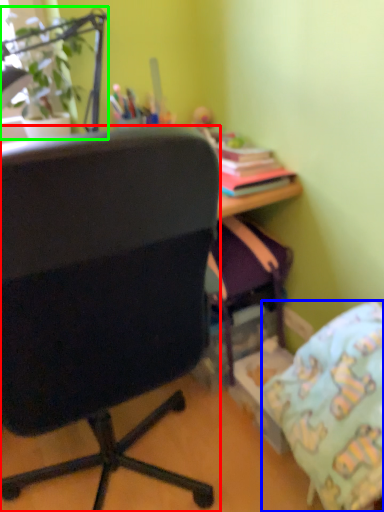
Question: Which object is the closest to the chair (highlighted by a red box)? Choose among these: pillow (highlighted by a blue box) or houseplant (highlighted by a green box).

Choices:
 (A) pillow
 (B) houseplant

Answer: (A)